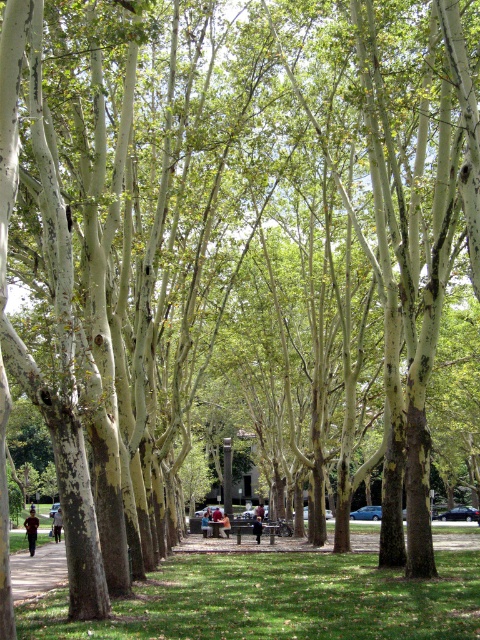
You are standing at the entrance of the park and see two points marked in the image. If you walk straight ahead, which point will you encounter first, point [227,518] or point [259,534]?

Point [259,534] will be encountered first because it is in front of point [227,518].

You are standing at the entrance of the park and see both the dark blue uniform at center and the light brown leather jacket at center. If you want to reach both items, which one should you approach first to minimize the distance traveled?

You should approach the dark blue uniform at center first since it is closer to you than the light brown leather jacket at center, as they are 10.54 meters apart.

You are standing in the park and see a person wearing a brown leather jacket at center and dark blue jeans at center. Which piece of clothing is positioned more to the left?

The brown leather jacket at center is positioned more to the left than the dark blue jeans at center.